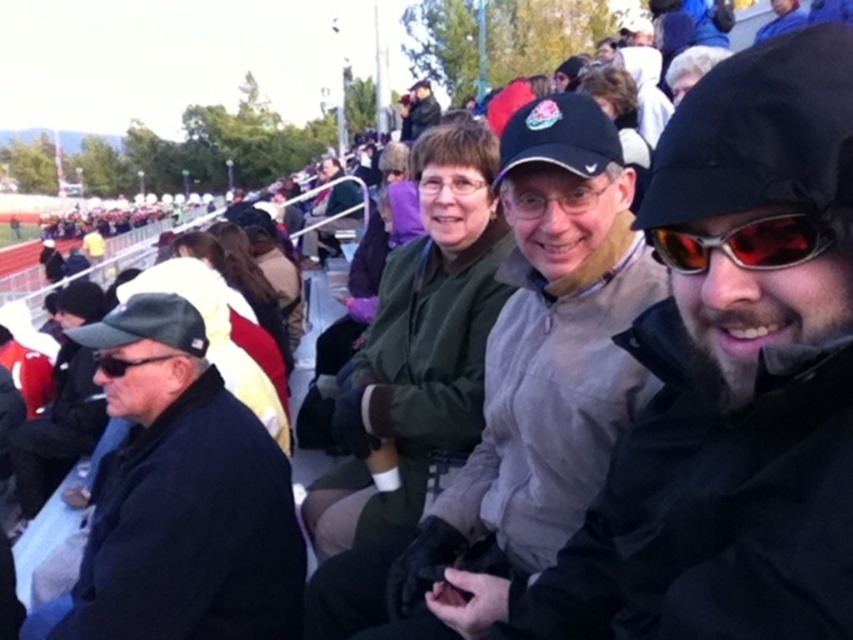
Which is below, black matte jacket at left or shiny metallic goggles at center?

black matte jacket at left is below.

Between black matte jacket at left and shiny metallic goggles at center, which one has less height?

shiny metallic goggles at center

Between point (164, 392) and point (665, 257), which one is positioned behind?

Positioned behind is point (164, 392).

Where is `black matte jacket at left`? black matte jacket at left is located at coordinates (180, 499).

Is point (439, 518) less distant than point (552, 195)?

No, (439, 518) is behind (552, 195).

Find the location of a particular element. gray fleece jacket at center is located at coordinates (525, 387).

Does point (770, 216) come in front of point (601, 192)?

Yes, it is.

Does shiny metallic goggles at center have a smaller size compared to matte black glasses at center?

Indeed, shiny metallic goggles at center has a smaller size compared to matte black glasses at center.

Is point (677, 250) more distant than point (589, 195)?

That is False.

Identify the location of shiny metallic goggles at center. (744, 243).